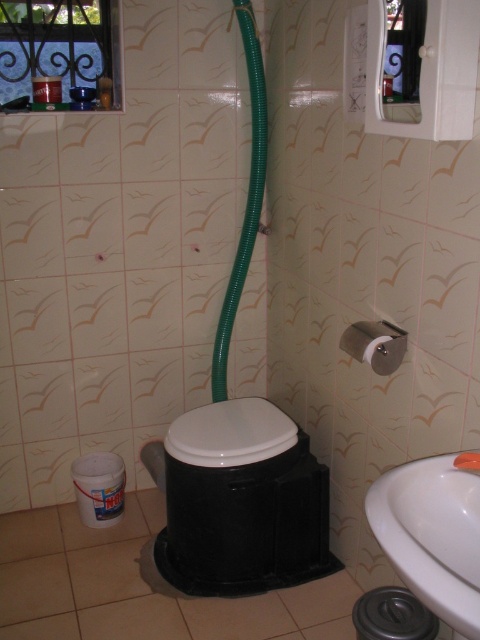
You are standing in the bathroom and want to reach a point that is 6.48 feet away from you. Can you confirm if the point you are aiming for is the point marked at coordinates point (169,573)?

The point marked at coordinates point (169,573) is exactly 6.48 feet away from the viewer, so yes, the point you are aiming for is the point marked at coordinates point (169,573).

You are a plumber inspecting the bathroom and need to locate the white glossy sink at lower right and the white ceramic faucet at lower right. According to the scene, which one is more to the left?

The white glossy sink at lower right is positioned on the left side of white ceramic faucet at lower right, so the white glossy sink at lower right is more to the left.

You are designing a layout for a small bathroom and need to place the black plastic toilet at lower center and the white ceramic faucet at lower right. Given their sizes, which object would require more floor space?

The black plastic toilet at lower center requires more floor space because it is larger in size than the white ceramic faucet at lower right.